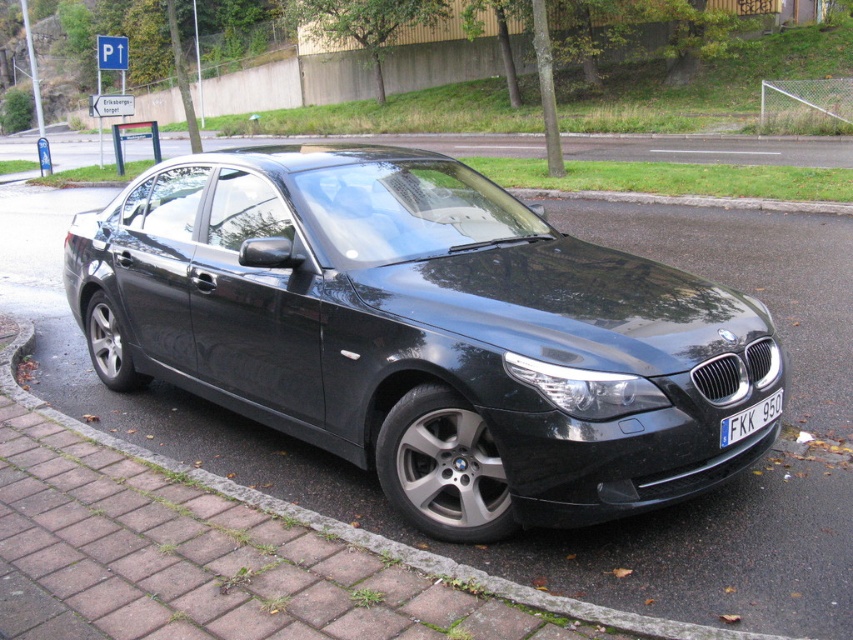
Is glossy black car at center shorter than white plastic license plate at front?

No.

Is glossy black car at center below white plastic license plate at front?

No.

Image resolution: width=853 pixels, height=640 pixels. I want to click on glossy black car at center, so click(422, 332).

Is brick pavement at lower left behind white plastic license plate at front?

Answer: No, it is not.

The width and height of the screenshot is (853, 640). Describe the element at coordinates (358, 529) in the screenshot. I see `brick pavement at lower left` at that location.

Identify the location of brick pavement at lower left. (358, 529).

Does glossy black car at center have a larger size compared to brick pavement at lower left?

Indeed, glossy black car at center has a larger size compared to brick pavement at lower left.

Which of these two, glossy black car at center or brick pavement at lower left, stands shorter?

brick pavement at lower left

The width and height of the screenshot is (853, 640). Describe the element at coordinates (422, 332) in the screenshot. I see `glossy black car at center` at that location.

Where is `glossy black car at center`? glossy black car at center is located at coordinates (422, 332).